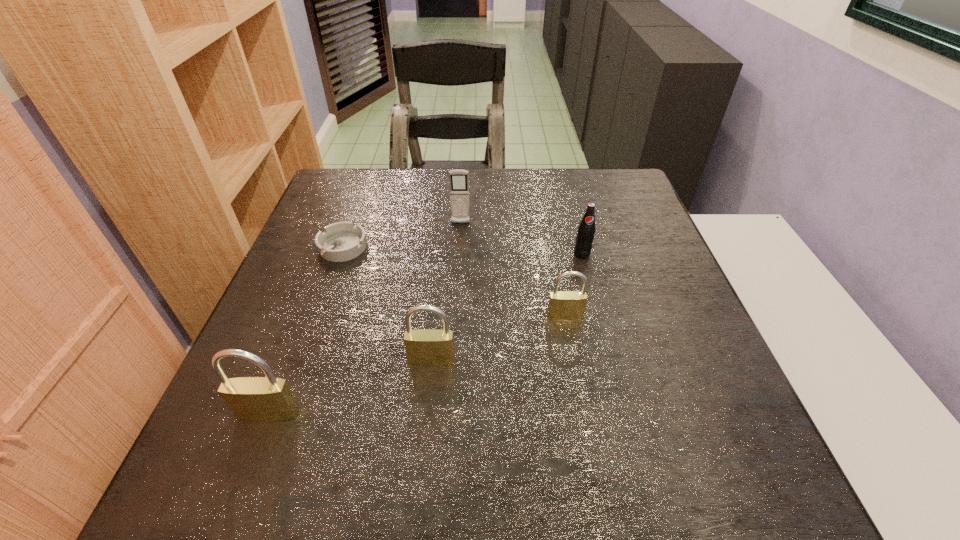
Where is `the nearest padlock`? The width and height of the screenshot is (960, 540). the nearest padlock is located at coordinates (252, 399).

Image resolution: width=960 pixels, height=540 pixels. What are the coordinates of `the nearest object` in the screenshot? It's located at (252, 399).

Locate an element on the screen. the second padlock from left to right is located at coordinates (428, 347).

Identify the location of the second nearest object. (428, 347).

Locate an element on the screen. This screenshot has width=960, height=540. the shortest padlock is located at coordinates (563, 305).

The image size is (960, 540). I want to click on the third nearest object, so click(563, 305).

Locate an element on the screen. the farthest object is located at coordinates (458, 178).

This screenshot has height=540, width=960. In order to click on the shortest object in this screenshot , I will do `click(342, 241)`.

You are a GUI agent. You are given a task and a screenshot of the screen. Output one action in this format:
    pyautogui.click(x=<x>, y=<y>)
    Task: Click on the pop
    
    Given the screenshot: What is the action you would take?
    click(x=585, y=233)

Locate an element on the screen. free space located 0.110m on the front-facing side of the second farthest padlock is located at coordinates (425, 420).